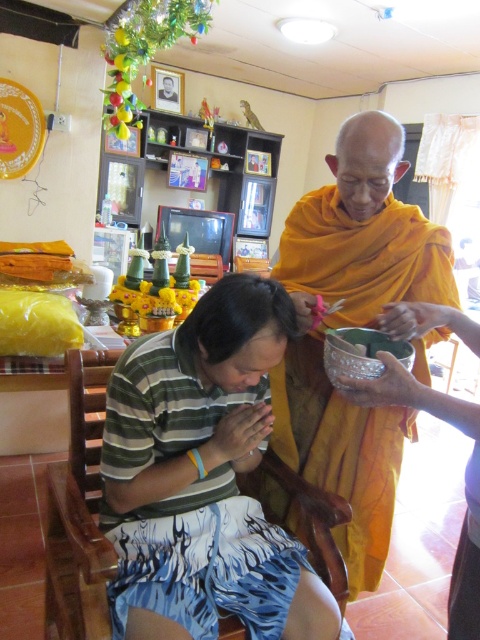
You are a photographer trying to capture a respectful shot of the scene without disturbing the ceremony. You need to ensure that the wooden chair at lower center and the black matte hair at center are both clearly visible in the frame. Considering their sizes, which object should you focus on first to ensure it is in sharp focus?

The wooden chair at lower center is much taller than the black matte hair at center, so focusing on the wooden chair at lower center first will ensure it is in sharp focus, and the black matte hair at center will also be in focus due to its smaller size.

You are standing in the room and want to place a small offering on the orange cloth at upper right. The cloth is represented by the point at coordinates (x=355, y=324). If you move straight towards the cloth from your current position, will you reach it before reaching the person in the striped green and white shirt?

The orange cloth at upper right is represented by the point at coordinates (x=355, y=324). Since the cloth is located at a specific point, moving straight towards it would allow you to reach it before encountering the person in the striped green and white shirt, assuming no obstacles are in the way.